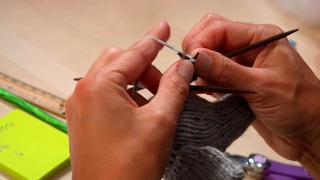
Identify the location of table. This screenshot has height=180, width=320. (75, 38).